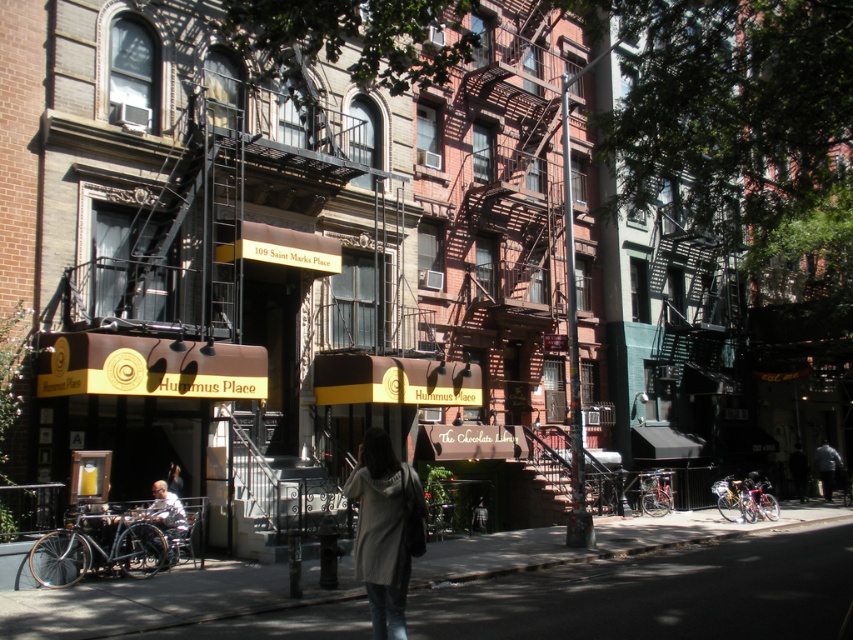
Question: Which object appears closest to the camera in this image?

Choices:
 (A) smooth asphalt sidewalk at center
 (B) knit sweater at center
 (C) dark gray fabric jacket at lower right

Answer: (B)

Question: Can you confirm if smooth asphalt sidewalk at center is bigger than white fabric shirt at lower left?

Choices:
 (A) no
 (B) yes

Answer: (B)

Question: Considering the real-world distances, which object is closest to the dark gray fabric jacket at lower right?

Choices:
 (A) smooth asphalt sidewalk at center
 (B) white fabric shirt at lower left

Answer: (A)

Question: Is smooth asphalt sidewalk at center positioned at the back of knit sweater at center?

Choices:
 (A) no
 (B) yes

Answer: (B)

Question: Can you confirm if smooth asphalt sidewalk at center is wider than white fabric shirt at lower left?

Choices:
 (A) no
 (B) yes

Answer: (B)

Question: Which point is closer to the camera taking this photo?

Choices:
 (A) (833, 460)
 (B) (370, 605)
 (C) (527, 604)
 (D) (167, 541)

Answer: (B)